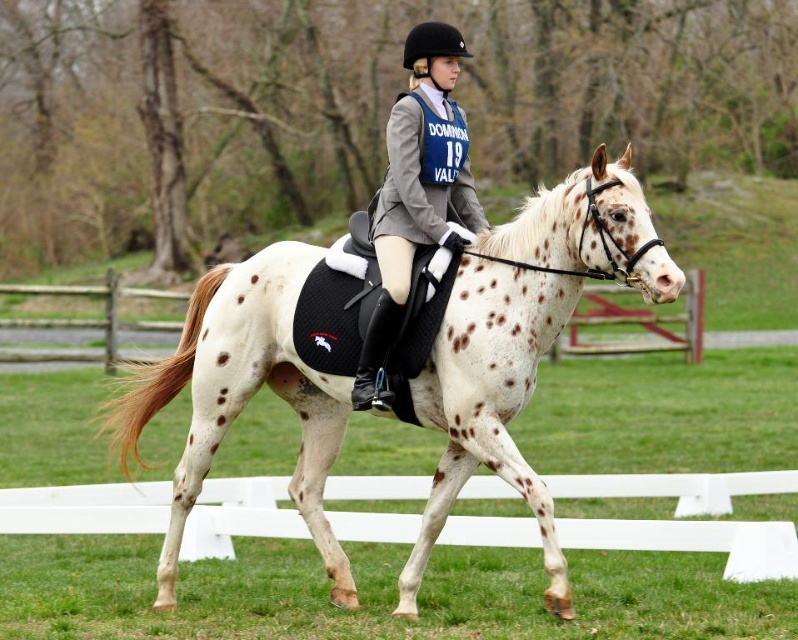
You are an equestrian judge observing the speckled white horse at center and the matte gray jacket at center. Which object is shorter in height?

The speckled white horse at center has a lesser height compared to matte gray jacket at center, so the speckled white horse at center is shorter.

You are a photographer standing at the edge of a field. You want to take a photo of the speckled white horse at center. If your camera has a maximum focus range of 8 meters, will you be able to capture the horse clearly?

The photographer and the speckled white horse at center are 8.19 meters apart. Since the camera can only focus up to 8 meters, the horse is slightly out of range. To capture it clearly, move closer or use a different camera with a longer focus range.

You are an observer standing in front of the equestrian scene. You see the speckled white horse at center and the matte gray jacket at center. Which object is positioned more to the left?

The speckled white horse at center is positioned to the left of the matte gray jacket at center.